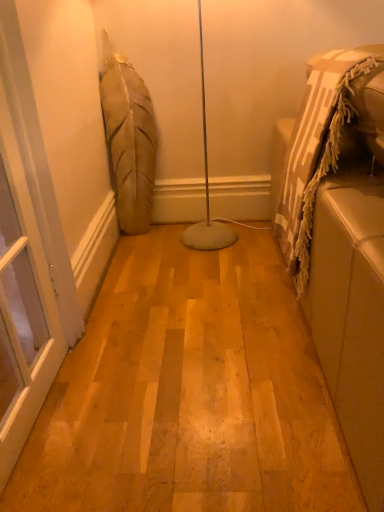
Image resolution: width=384 pixels, height=512 pixels. Describe the element at coordinates (28, 255) in the screenshot. I see `transparent glass screen door at left` at that location.

Locate an element on the screen. transparent glass screen door at left is located at coordinates (28, 255).

The image size is (384, 512). What do you see at coordinates (339, 244) in the screenshot? I see `beige fabric couch at right` at bounding box center [339, 244].

Where is `beige fabric couch at right`? beige fabric couch at right is located at coordinates (339, 244).

Find the location of a particular element. The height and width of the screenshot is (512, 384). transparent glass screen door at left is located at coordinates (28, 255).

Which is more to the left, beige fabric couch at right or transparent glass screen door at left?

transparent glass screen door at left is more to the left.

From the picture: Considering the relative positions of beige fabric couch at right and transparent glass screen door at left in the image provided, is beige fabric couch at right in front of transparent glass screen door at left?

Yes, the depth of beige fabric couch at right is less than that of transparent glass screen door at left.

Does point (324, 95) lie behind point (16, 420)?

Yes.

From the image's perspective, which one is positioned lower, beige fabric couch at right or transparent glass screen door at left?

transparent glass screen door at left appears lower in the image.

From a real-world perspective, between beige fabric couch at right and transparent glass screen door at left, who is vertically higher?

transparent glass screen door at left is physically above.

Considering the relative sizes of beige fabric couch at right and transparent glass screen door at left in the image provided, is beige fabric couch at right thinner than transparent glass screen door at left?

No, beige fabric couch at right is not thinner than transparent glass screen door at left.

Can you confirm if beige fabric couch at right is shorter than transparent glass screen door at left?

Yes.

Considering the sizes of beige fabric couch at right and transparent glass screen door at left in the image, is beige fabric couch at right bigger or smaller than transparent glass screen door at left?

In the image, beige fabric couch at right appears to be larger than transparent glass screen door at left.

Do you think beige fabric couch at right is within transparent glass screen door at left, or outside of it?

beige fabric couch at right is not inside transparent glass screen door at left, it's outside.

Is beige fabric couch at right positioned far away from transparent glass screen door at left?

No, there isn't a large distance between beige fabric couch at right and transparent glass screen door at left.

Is beige fabric couch at right looking in the opposite direction of transparent glass screen door at left?

Yes, beige fabric couch at right's orientation is away from transparent glass screen door at left.

From the picture: How distant is beige fabric couch at right from transparent glass screen door at left?

33.75 inches.

Where is `screen door lying below the beige fabric couch at right (from the image's perspective)`? The width and height of the screenshot is (384, 512). screen door lying below the beige fabric couch at right (from the image's perspective) is located at coordinates (28, 255).

Is transparent glass screen door at left to the left of beige fabric couch at right from the viewer's perspective?

Yes.

Is transparent glass screen door at left positioned before beige fabric couch at right?

No.

Looking at this image, which is closer to the camera, (4, 13) or (329, 204)?

The point (4, 13) is closer.

From the image's perspective, which object appears higher, transparent glass screen door at left or beige fabric couch at right?

beige fabric couch at right.

From a real-world perspective, is transparent glass screen door at left positioned over beige fabric couch at right based on gravity?

Yes.

In terms of width, does transparent glass screen door at left look wider or thinner when compared to beige fabric couch at right?

transparent glass screen door at left is thinner than beige fabric couch at right.

Who is shorter, transparent glass screen door at left or beige fabric couch at right?

With less height is beige fabric couch at right.

Does transparent glass screen door at left have a smaller size compared to beige fabric couch at right?

Indeed, transparent glass screen door at left has a smaller size compared to beige fabric couch at right.

In the scene shown: Is transparent glass screen door at left positioned beyond the bounds of beige fabric couch at right?

Absolutely, transparent glass screen door at left is external to beige fabric couch at right.

Is transparent glass screen door at left not near beige fabric couch at right?

transparent glass screen door at left is actually quite close to beige fabric couch at right.

Is transparent glass screen door at left positioned with its back to beige fabric couch at right?

That's not correct — transparent glass screen door at left is not looking away from beige fabric couch at right.

How different are the orientations of transparent glass screen door at left and beige fabric couch at right in degrees?

There is a 0.0191-degree angle between the facing directions of transparent glass screen door at left and beige fabric couch at right.

There is a beige fabric couch at right. Identify the location of screen door above it (from a real-world perspective). (28, 255).

This screenshot has width=384, height=512. I want to click on furniture that is on the right side of transparent glass screen door at left, so click(x=339, y=244).

At what (x,y) coordinates should I click in order to perform the action: click on furniture directly beneath the transparent glass screen door at left (from a real-world perspective). Please return your answer as a coordinate pair (x, y). The image size is (384, 512). Looking at the image, I should click on tap(339, 244).